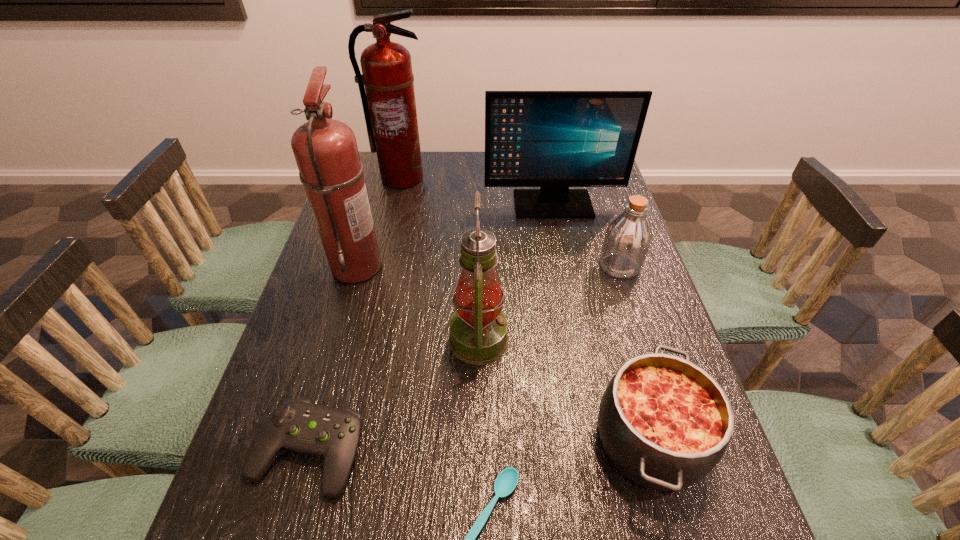
Where is `vacant space located 0.340m on the screen side of the second farthest object`? vacant space located 0.340m on the screen side of the second farthest object is located at coordinates (572, 301).

Locate an element on the screen. vacant point located 0.360m on the front of the bottle is located at coordinates (664, 404).

Where is `free space located on the back of the casserole`? free space located on the back of the casserole is located at coordinates (612, 308).

The width and height of the screenshot is (960, 540). Identify the location of free space located 0.310m on the right of the seventh tallest object. (524, 451).

This screenshot has width=960, height=540. In order to click on object that is positioned at the far edge in this screenshot , I will do `click(389, 106)`.

Locate an element on the screen. control that is at the left edge is located at coordinates (297, 424).

The image size is (960, 540). In order to click on monitor that is at the right edge in this screenshot , I will do tap(554, 140).

Locate an element on the screen. The image size is (960, 540). bottle that is at the right edge is located at coordinates (628, 237).

The width and height of the screenshot is (960, 540). What are the coordinates of `casserole at the right edge` in the screenshot? It's located at (665, 423).

This screenshot has height=540, width=960. I want to click on object that is positioned at the far left corner, so click(389, 106).